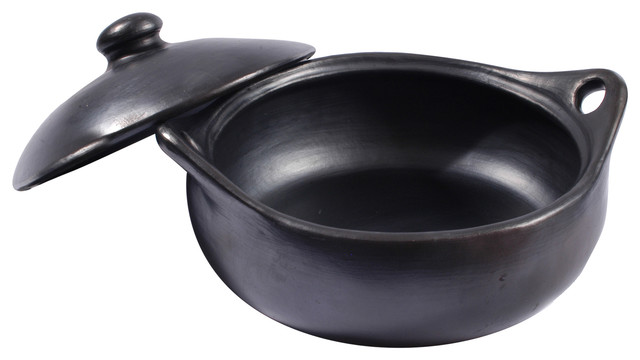
Locate an element on the screen. The width and height of the screenshot is (640, 360). handle is located at coordinates pos(131,29).